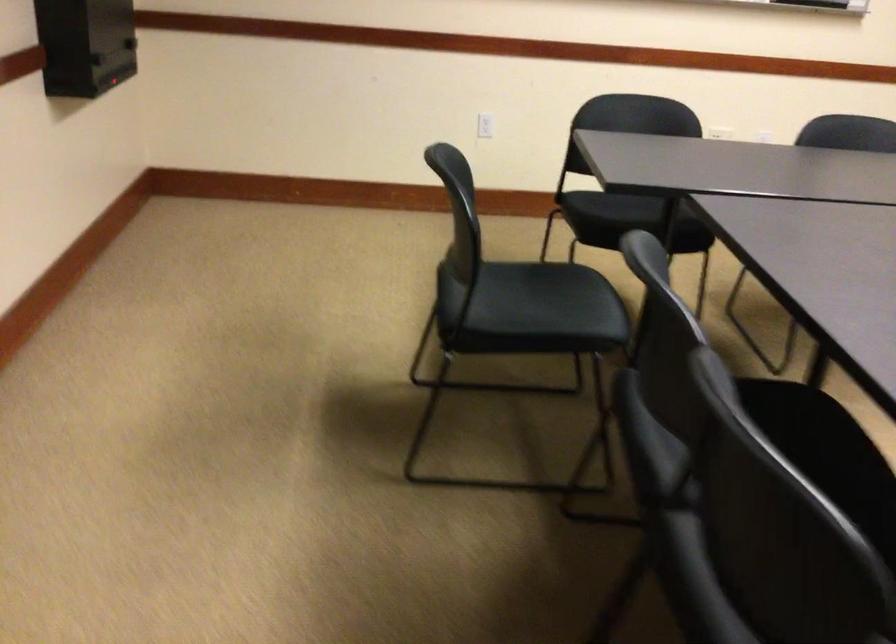
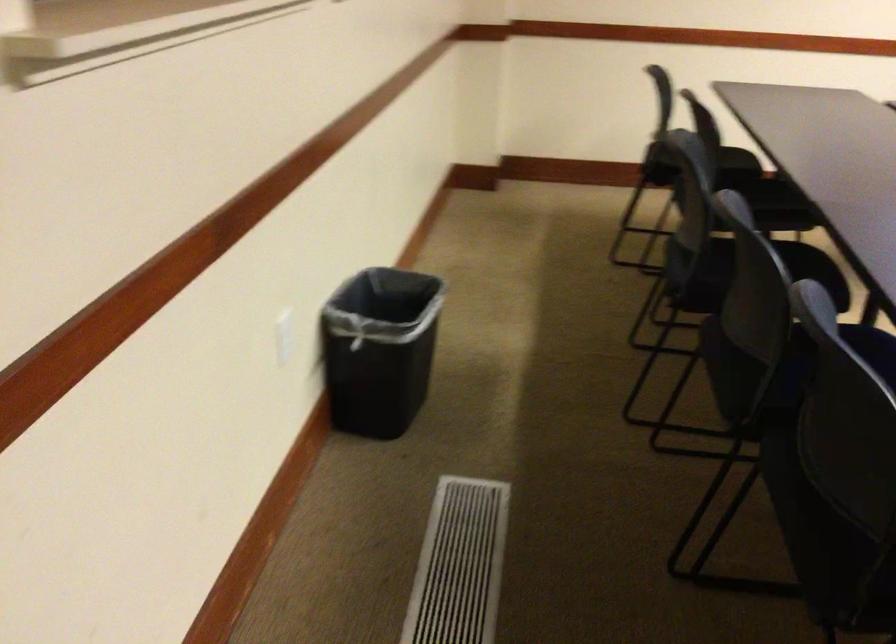
Question: The images are taken continuously from a first-person perspective. In which direction are you moving?

Choices:
 (A) Left
 (B) Right
 (C) Forward
 (D) Backward

Answer: (D)